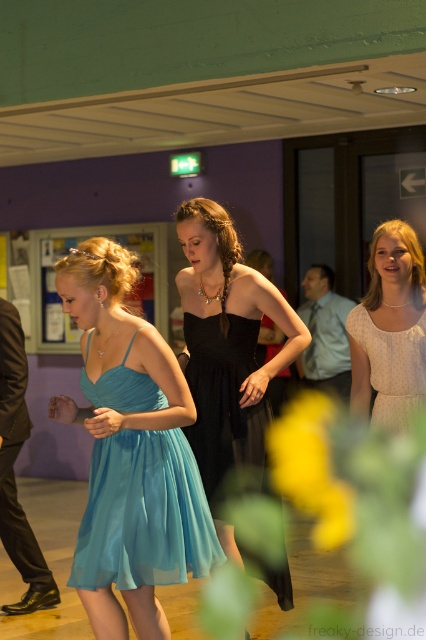
Question: Estimate the real-world distances between objects in this image. Which object is farther from the light beige textured dress at right?

Choices:
 (A) black satin dress at center
 (B) light beige textured dress at center

Answer: (A)

Question: Which object is farther from the camera taking this photo?

Choices:
 (A) light beige textured dress at right
 (B) light blue chiffon dress at center
 (C) light beige textured dress at center

Answer: (A)

Question: Can you confirm if black satin dress at center is positioned below light beige textured dress at center?

Choices:
 (A) no
 (B) yes

Answer: (B)

Question: In this image, where is light beige textured dress at right located relative to light beige textured dress at center?

Choices:
 (A) below
 (B) above

Answer: (B)

Question: Is black satin dress at center to the left of light beige textured dress at center from the viewer's perspective?

Choices:
 (A) yes
 (B) no

Answer: (A)

Question: Based on their relative distances, which object is farther from the light blue chiffon dress at center?

Choices:
 (A) light beige textured dress at right
 (B) black satin dress at center
 (C) light beige textured dress at center

Answer: (A)